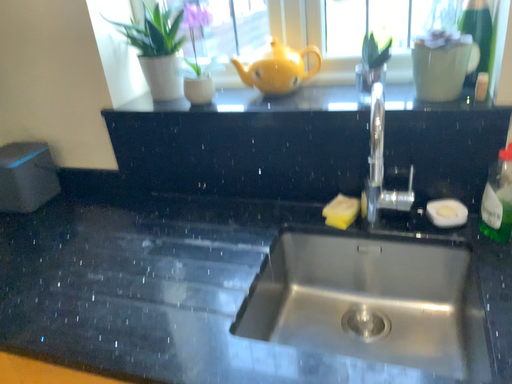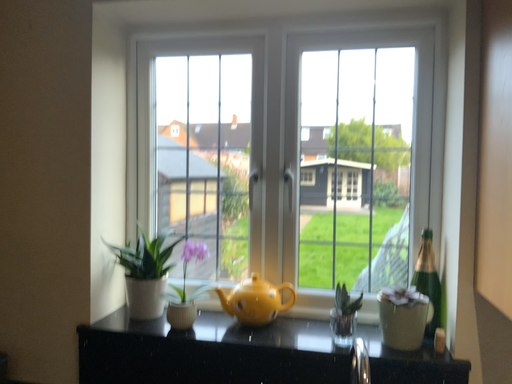
Question: How did the camera likely rotate when shooting the video?

Choices:
 (A) rotated upward
 (B) rotated downward

Answer: (A)